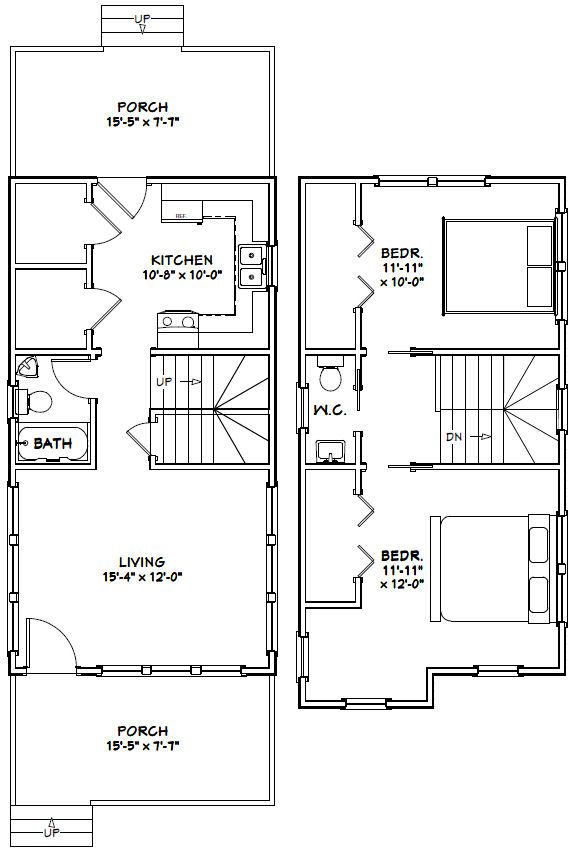
I want to click on stairs, so (179, 389), (181, 438), (462, 377), (467, 432), (72, 827), (120, 25).